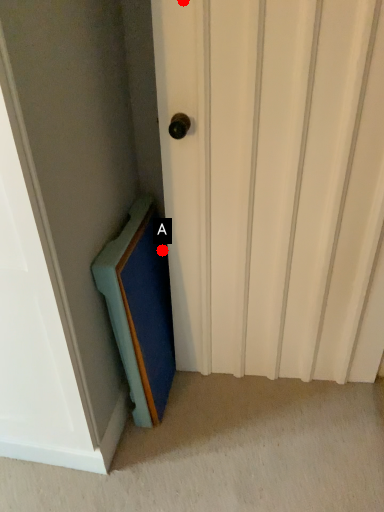
Question: Two points are circled on the image, labeled by A and B beside each circle. Which of the following is the closest to the observer?

Choices:
 (A) A is closer
 (B) B is closer

Answer: (B)